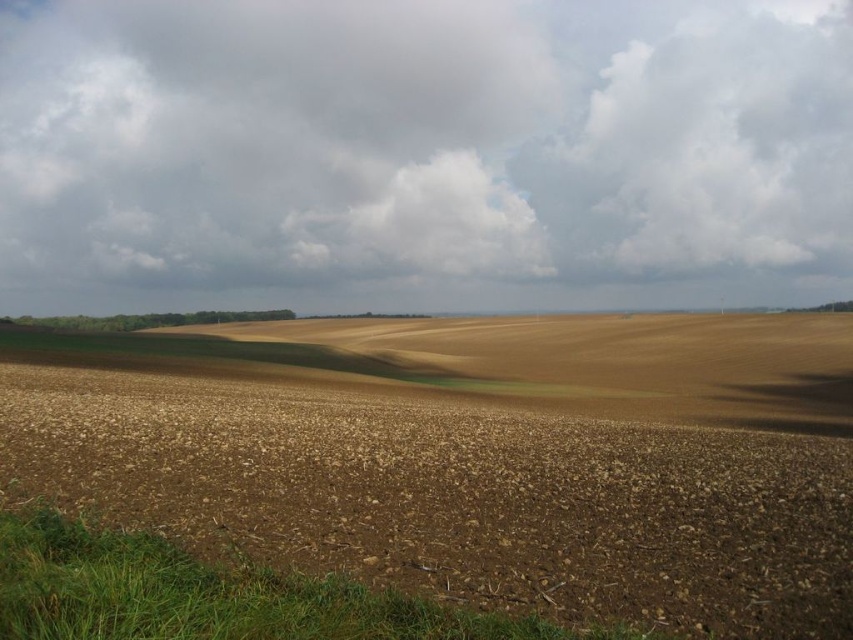
Question: Which object appears farthest from the camera in this image?

Choices:
 (A) cloudy sky at upper center
 (B) brown soil at center

Answer: (A)

Question: Is cloudy sky at upper center above brown soil at center?

Choices:
 (A) yes
 (B) no

Answer: (A)

Question: Does cloudy sky at upper center appear under brown soil at center?

Choices:
 (A) yes
 (B) no

Answer: (B)

Question: Which of the following is the closest to the observer?

Choices:
 (A) (135, 400)
 (B) (730, 118)

Answer: (A)

Question: Which point appears farthest from the camera in this image?

Choices:
 (A) (457, 372)
 (B) (169, 188)

Answer: (B)

Question: Is cloudy sky at upper center positioned before brown soil at center?

Choices:
 (A) yes
 (B) no

Answer: (B)